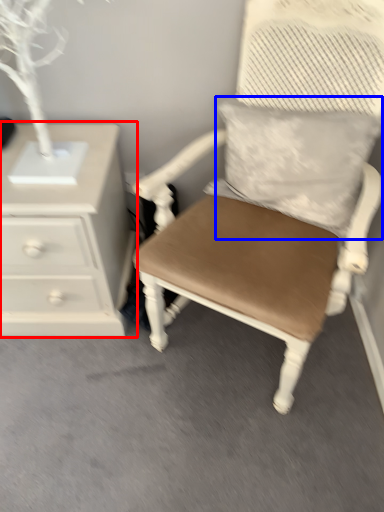
Question: Which object appears closest to the camera in this image, chest of drawers (highlighted by a red box) or pillow (highlighted by a blue box)?

Choices:
 (A) chest of drawers
 (B) pillow

Answer: (B)